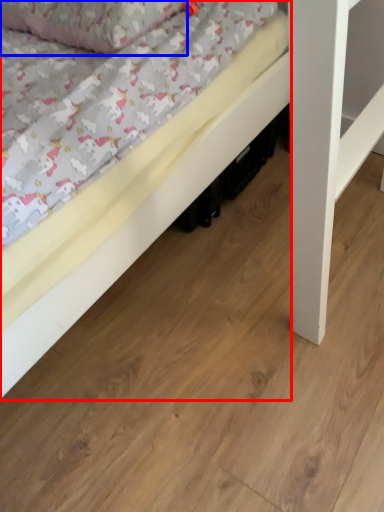
Question: Which point is further to the camera, bed (highlighted by a red box) or pillow (highlighted by a blue box)?

Choices:
 (A) bed
 (B) pillow

Answer: (B)